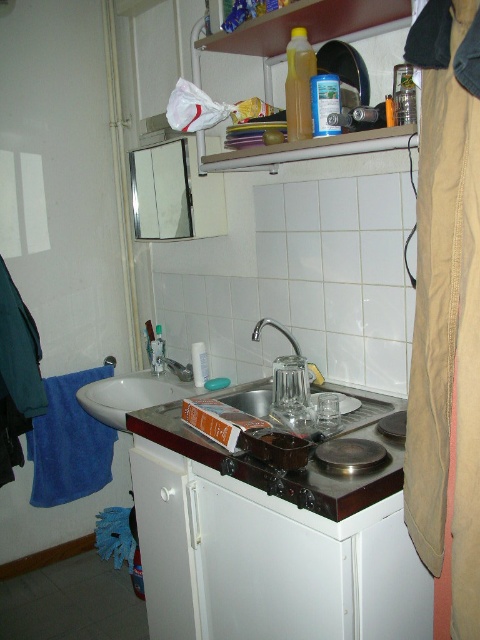
Is brown wooden counter at center behind brushed metal faucet at sink left?

No, brown wooden counter at center is in front of brushed metal faucet at sink left.

Does brown wooden counter at center have a greater width compared to brushed metal faucet at sink left?

Yes, brown wooden counter at center is wider than brushed metal faucet at sink left.

I want to click on brown wooden counter at center, so click(x=288, y=472).

Does brown wooden counter at center have a smaller size compared to silver metallic faucet at center?

Actually, brown wooden counter at center might be larger than silver metallic faucet at center.

Does brown wooden counter at center come in front of silver metallic faucet at center?

Yes, brown wooden counter at center is in front of silver metallic faucet at center.

The height and width of the screenshot is (640, 480). What do you see at coordinates (288, 472) in the screenshot? I see `brown wooden counter at center` at bounding box center [288, 472].

Where is `brown wooden counter at center`? brown wooden counter at center is located at coordinates (288, 472).

How much distance is there between black glass stove at center and brushed metal faucet at sink left?

black glass stove at center and brushed metal faucet at sink left are 1.15 meters apart from each other.

Who is more forward, (291, 483) or (176, 365)?

Point (291, 483) is in front.

Between point (285, 496) and point (175, 360), which one is positioned in front?

Point (285, 496) is in front.

You are a GUI agent. You are given a task and a screenshot of the screen. Output one action in this format:
    pyautogui.click(x=<x>, y=<y>)
    Task: Click on the black glass stove at center
    This screenshot has height=640, width=480.
    Given the screenshot: What is the action you would take?
    pyautogui.click(x=323, y=477)